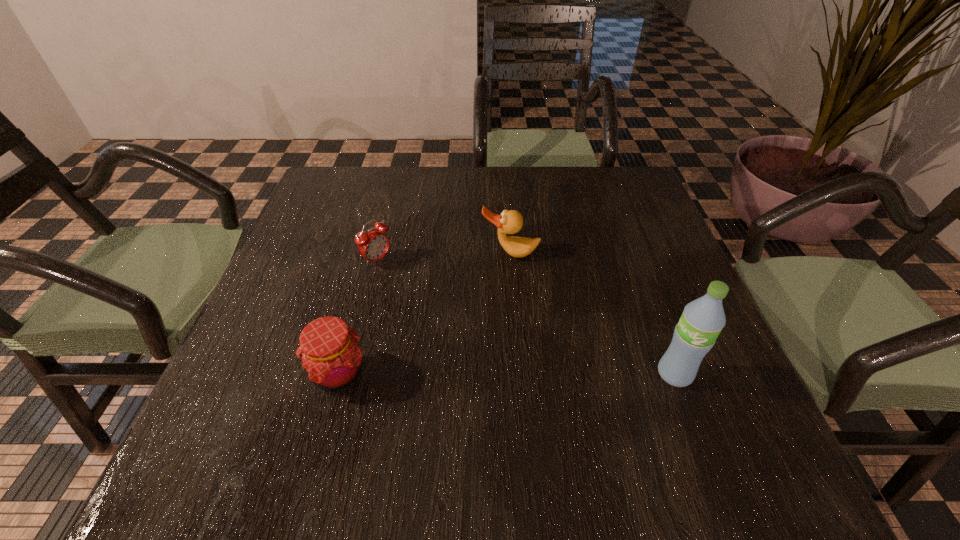
Identify the location of jam. (329, 350).

In order to click on the tallest object in this screenshot , I will do `click(702, 320)`.

Where is `water bottle`? Image resolution: width=960 pixels, height=540 pixels. water bottle is located at coordinates (702, 320).

Image resolution: width=960 pixels, height=540 pixels. What are the coordinates of `the third object from left to right` in the screenshot? It's located at pyautogui.click(x=509, y=222).

The width and height of the screenshot is (960, 540). I want to click on alarm clock, so click(x=373, y=245).

In order to click on vacant space situated on the back of the jam in this screenshot , I will do `click(372, 249)`.

The image size is (960, 540). What are the coordinates of `free region located 0.130m on the back of the rightmost object` in the screenshot? It's located at (650, 308).

Locate an element on the screen. Image resolution: width=960 pixels, height=540 pixels. vacant space located on the beak of the second object from right to left is located at coordinates (488, 395).

The width and height of the screenshot is (960, 540). Identify the location of free space located on the beak of the second object from right to left. (486, 406).

Where is `vacant region located on the beak of the second object from right to left`? The width and height of the screenshot is (960, 540). vacant region located on the beak of the second object from right to left is located at coordinates (495, 337).